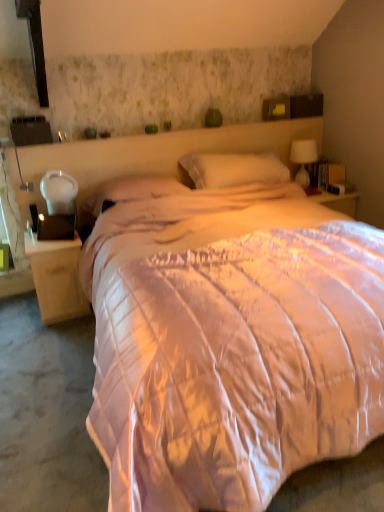
Question: In which direction should I rotate to look at white soft pillow at center, which appears as the first pillow when viewed from the right?

Choices:
 (A) left
 (B) right

Answer: (B)

Question: Considering the relative positions of white soft pillow at center, placed as the 2th pillow when sorted from left to right, and white matte nightstand at left in the image provided, is white soft pillow at center, placed as the 2th pillow when sorted from left to right, behind white matte nightstand at left?

Choices:
 (A) yes
 (B) no

Answer: (A)

Question: From the image's perspective, is white soft pillow at center, which appears as the first pillow when viewed from the right, on white matte nightstand at left?

Choices:
 (A) no
 (B) yes

Answer: (B)

Question: Is white soft pillow at center, which appears as the first pillow when viewed from the right, oriented towards white matte nightstand at left?

Choices:
 (A) yes
 (B) no

Answer: (B)

Question: Can you confirm if white soft pillow at center, which appears as the first pillow when viewed from the right, is bigger than white matte nightstand at left?

Choices:
 (A) no
 (B) yes

Answer: (B)

Question: Is white soft pillow at center, placed as the 2th pillow when sorted from left to right, shorter than white matte nightstand at left?

Choices:
 (A) no
 (B) yes

Answer: (B)

Question: Is white soft pillow at center, placed as the 2th pillow when sorted from left to right, at the left side of white matte nightstand at left?

Choices:
 (A) yes
 (B) no

Answer: (B)

Question: From a real-world perspective, does matte pink pillow at center, which is the first pillow from left to right, stand above white matte nightstand at left?

Choices:
 (A) no
 (B) yes

Answer: (B)

Question: From the image's perspective, is matte pink pillow at center, which is the first pillow from left to right, above white matte nightstand at left?

Choices:
 (A) yes
 (B) no

Answer: (A)

Question: Considering the relative positions of matte pink pillow at center, which is the 2th pillow in right-to-left order, and white matte nightstand at left in the image provided, is matte pink pillow at center, which is the 2th pillow in right-to-left order, to the left of white matte nightstand at left from the viewer's perspective?

Choices:
 (A) no
 (B) yes

Answer: (A)

Question: From the image's perspective, does matte pink pillow at center, which is the 2th pillow in right-to-left order, appear lower than white matte nightstand at left?

Choices:
 (A) no
 (B) yes

Answer: (A)

Question: Is white matte nightstand at left at the back of matte pink pillow at center, which is the 2th pillow in right-to-left order?

Choices:
 (A) yes
 (B) no

Answer: (B)

Question: Could white matte nightstand at left be considered to be inside matte pink pillow at center, which is the 2th pillow in right-to-left order?

Choices:
 (A) no
 (B) yes

Answer: (A)

Question: Is the position of white glass table lamp at upper right more distant than that of white soft pillow at center, placed as the 2th pillow when sorted from left to right?

Choices:
 (A) yes
 (B) no

Answer: (A)